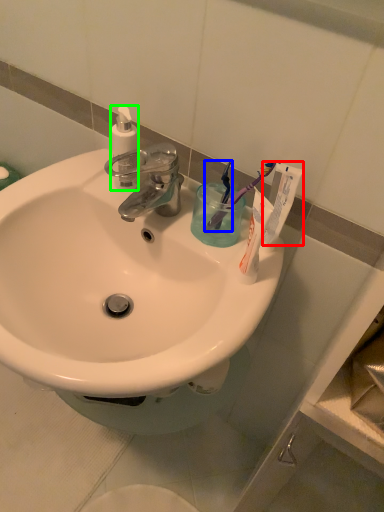
Question: Which object is the closest to the toothpaste (highlighted by a red box)? Choose among these: toothbrush (highlighted by a blue box) or toiletry (highlighted by a green box).

Choices:
 (A) toothbrush
 (B) toiletry

Answer: (A)